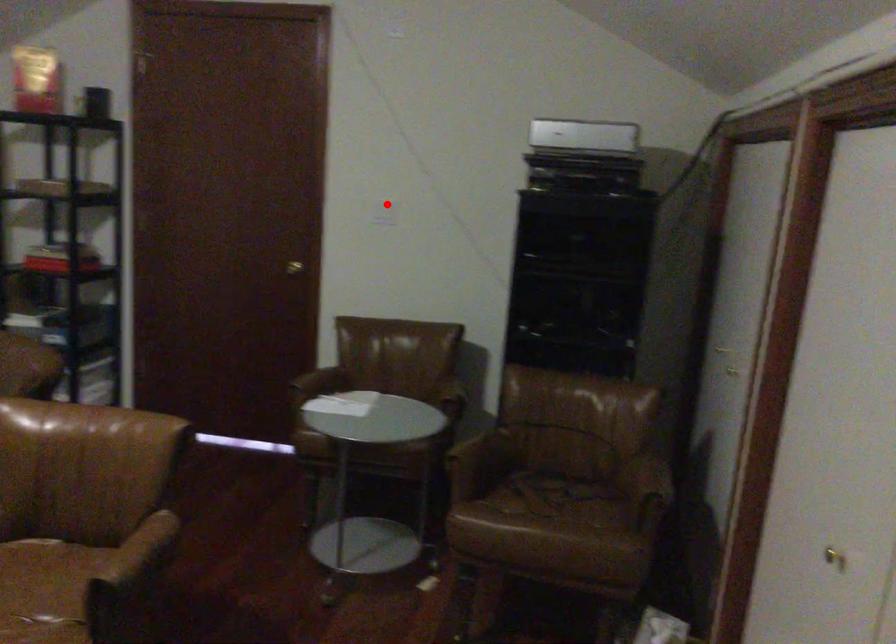
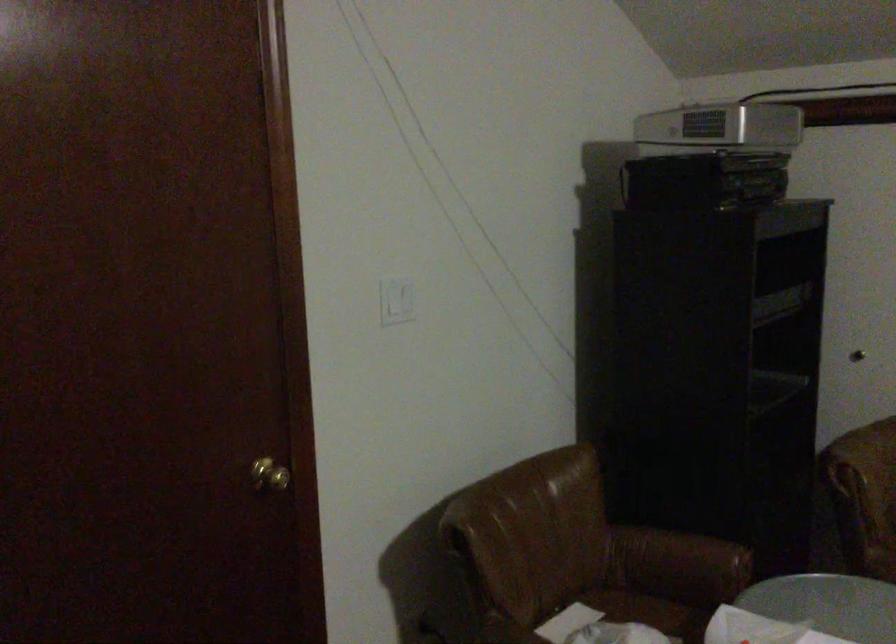
Question: I am providing you with two images of the same scene from different viewpoints. A red point is shown in image1. For the corresponding object point in image2, is it positioned nearer or farther from the camera?

Choices:
 (A) Nearer
 (B) Farther

Answer: (A)